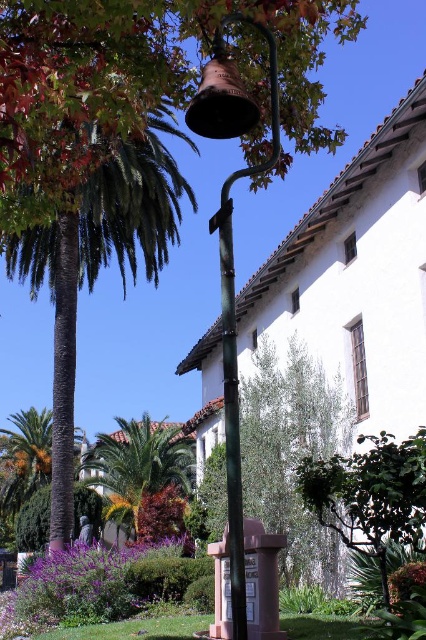
Does green painted metal bell at center have a greater width compared to green matte pole at center?

Yes, green painted metal bell at center is wider than green matte pole at center.

Is green painted metal bell at center closer to camera compared to green matte pole at center?

Yes, green painted metal bell at center is closer to the viewer.

This screenshot has width=426, height=640. Describe the element at coordinates (232, 259) in the screenshot. I see `green painted metal bell at center` at that location.

What are the coordinates of `green painted metal bell at center` in the screenshot? It's located at (232, 259).

Can you confirm if green leafy palm tree at left is taller than green matte pole at center?

Indeed, green leafy palm tree at left has a greater height compared to green matte pole at center.

Looking at this image, can you confirm if green leafy palm tree at left is bigger than green matte pole at center?

Yes.

Is point (97, 272) less distant than point (227, 401)?

No, (97, 272) is behind (227, 401).

Identify the location of green leafy palm tree at left. (98, 260).

Who is lower down, bronze bell at upper center or green matte pole at center?

green matte pole at center is lower down.

The height and width of the screenshot is (640, 426). What do you see at coordinates (233, 100) in the screenshot?
I see `bronze bell at upper center` at bounding box center [233, 100].

The width and height of the screenshot is (426, 640). I want to click on bronze bell at upper center, so click(x=233, y=100).